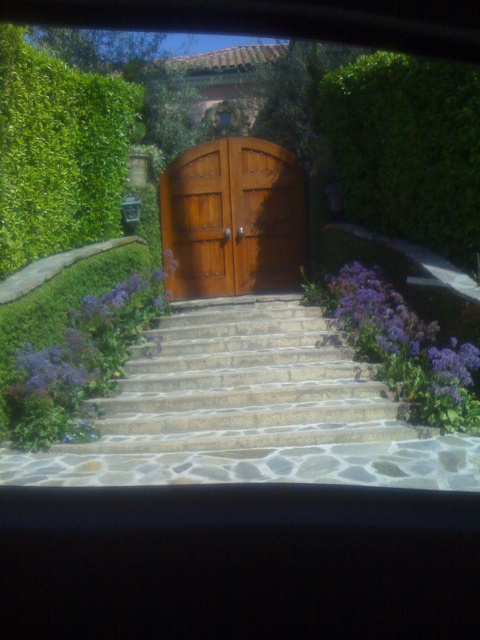
Question: Is green leafy hedge at upper left below wooden gate at center?

Choices:
 (A) yes
 (B) no

Answer: (B)

Question: Estimate the real-world distances between objects in this image. Which object is closer to the green leafy hedge at upper left?

Choices:
 (A) pebble stone stairs at center
 (B) wooden gate at center

Answer: (B)

Question: Which point is closer to the camera?

Choices:
 (A) green leafy hedge at upper left
 (B) pebble stone stairs at center
 (C) green leafy hedge at upper center

Answer: (B)

Question: Does wooden gate at center have a lesser width compared to purple matte flower at center?

Choices:
 (A) yes
 (B) no

Answer: (B)

Question: Can you confirm if green leafy hedge at upper center is positioned below wooden gate at center?

Choices:
 (A) no
 (B) yes

Answer: (A)

Question: Which of the following is the farthest from the observer?

Choices:
 (A) (211, 314)
 (B) (434, 152)
 (C) (381, 321)
 (D) (204, 275)

Answer: (D)